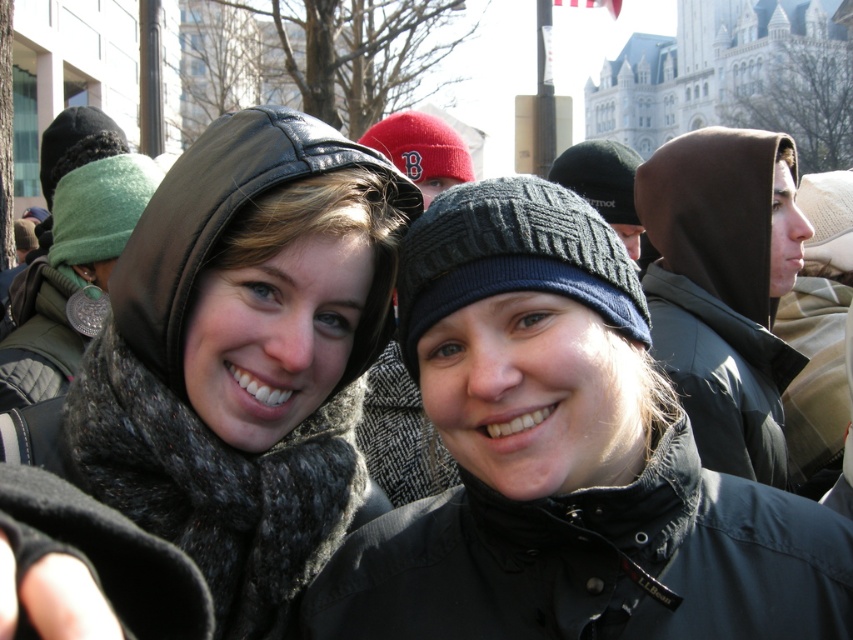
Question: Which point is farther to the camera?

Choices:
 (A) matte black hood at center
 (B) black knit hat at center

Answer: (B)

Question: Based on their relative distances, which object is nearer to the black knit hat at center?

Choices:
 (A) matte black hood at center
 (B) brown matte hood at right

Answer: (A)

Question: Can you confirm if black knit hat at center is thinner than matte black hood at center?

Choices:
 (A) no
 (B) yes

Answer: (A)

Question: Is matte black hood at center in front of brown matte hood at right?

Choices:
 (A) yes
 (B) no

Answer: (A)

Question: Does black knit hat at center have a lesser width compared to brown matte hood at right?

Choices:
 (A) yes
 (B) no

Answer: (B)

Question: Which of the following is the closest to the observer?

Choices:
 (A) brown matte hood at right
 (B) black knit hat at center

Answer: (B)